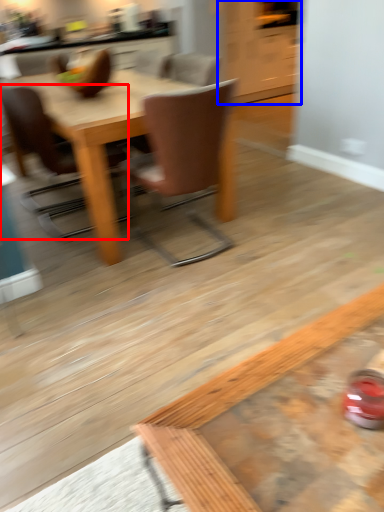
Question: Among these objects, which one is nearest to the camera, chair (highlighted by a red box) or cabinetry (highlighted by a blue box)?

Choices:
 (A) chair
 (B) cabinetry

Answer: (A)